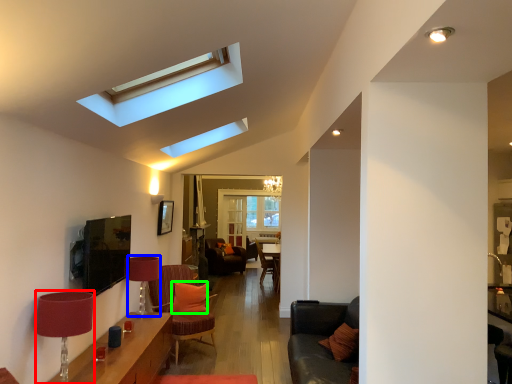
Question: Which is farther away from lamp (highlighted by a red box)? lamp (highlighted by a blue box) or pillow (highlighted by a green box)?

Choices:
 (A) lamp
 (B) pillow

Answer: (B)